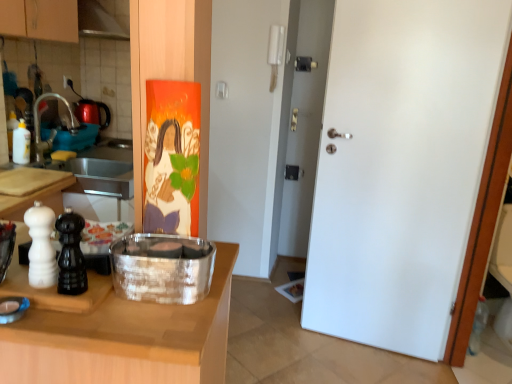
This screenshot has height=384, width=512. What are the coordinates of `vacant area that lies in front of silver metallic container at center` in the screenshot? It's located at (147, 315).